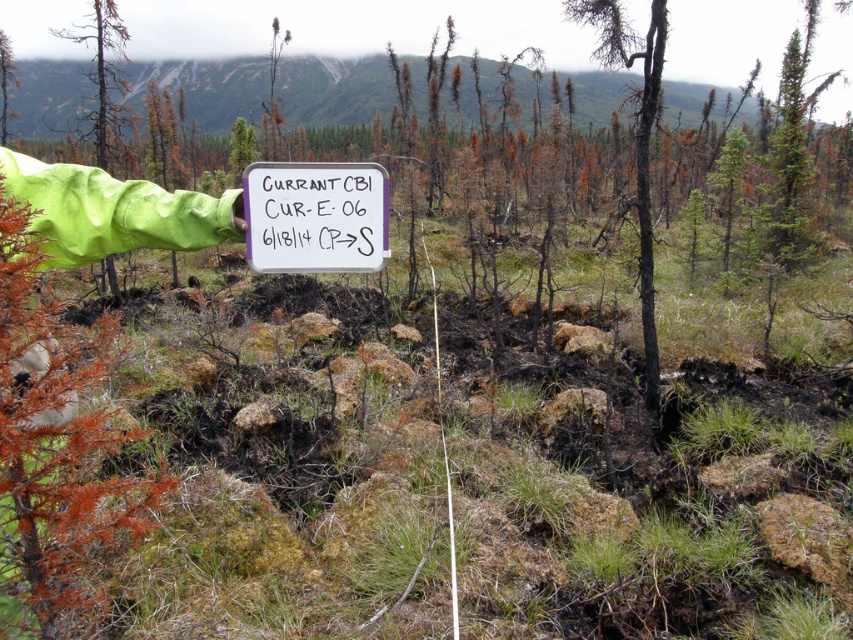
Is green rubber glove at left below brown bark tree at left?

Actually, green rubber glove at left is above brown bark tree at left.

Does point (103, 128) lie behind point (0, 120)?

No, (103, 128) is in front of (0, 120).

Image resolution: width=853 pixels, height=640 pixels. Identify the location of green rubber glove at left. (102, 61).

Which is in front, point (282, 259) or point (102, 140)?

Point (282, 259) is in front.

Locate an element on the screen. The width and height of the screenshot is (853, 640). white paper at center is located at coordinates (315, 216).

Which of these two, charred bark tree at center or brown bark tree at left, stands shorter?

With less height is charred bark tree at center.

Consider the image. Does charred bark tree at center have a smaller size compared to brown bark tree at left?

Yes, charred bark tree at center is smaller than brown bark tree at left.

Locate an element on the screen. The width and height of the screenshot is (853, 640). charred bark tree at center is located at coordinates (635, 140).

Where is `charred bark tree at center`? charred bark tree at center is located at coordinates (635, 140).